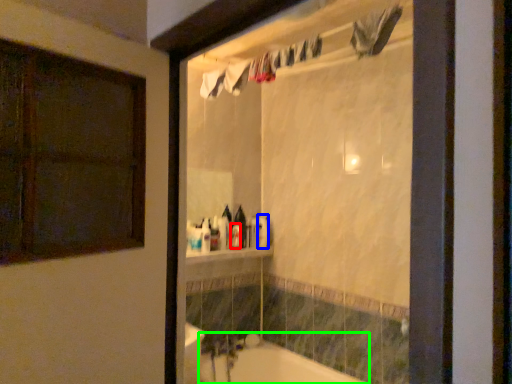
Question: Based on their relative distances, which object is farther from toiletry (highlighted by a red box)? Choose from toiletry (highlighted by a blue box) and bathtub (highlighted by a green box).

Choices:
 (A) toiletry
 (B) bathtub

Answer: (B)